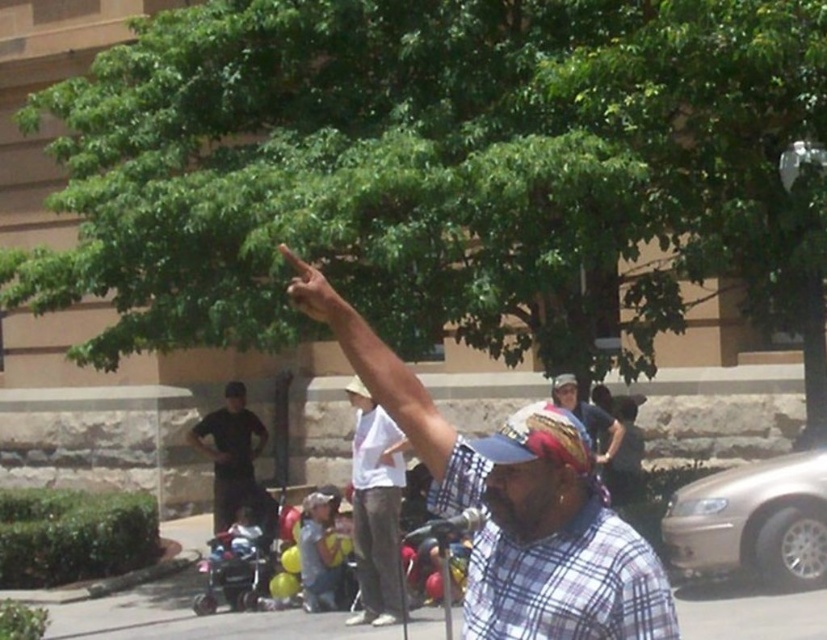
Question: Among these objects, which one is nearest to the camera?

Choices:
 (A) white cotton shirt at center
 (B) asphalt pavement at center
 (C) dark gray shirt at center

Answer: (B)

Question: Does plaid fabric at center lie behind dark gray shirt at center?

Choices:
 (A) no
 (B) yes

Answer: (A)

Question: Which point is closer to the camera?

Choices:
 (A) green leafy tree at upper center
 (B) asphalt pavement at center
 (C) plaid shirt at upper center

Answer: (C)

Question: Which object is the closest to the white cotton shirt at center?

Choices:
 (A) plaid shirt at upper center
 (B) green leafy tree at upper center
 (C) asphalt pavement at center

Answer: (C)

Question: Can you confirm if asphalt pavement at center is positioned above plaid shirt at center?

Choices:
 (A) no
 (B) yes

Answer: (A)

Question: Does plaid shirt at upper center have a smaller size compared to white cotton shirt at center?

Choices:
 (A) no
 (B) yes

Answer: (B)